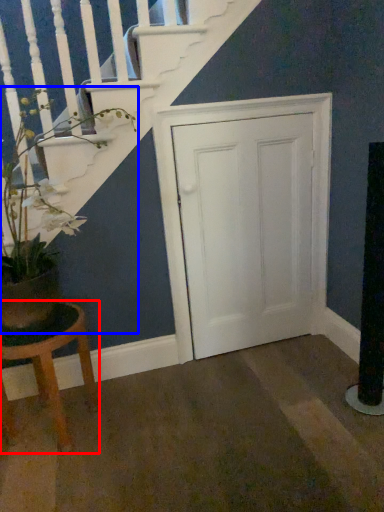
Question: Which of the following is the closest to the observer, stool (highlighted by a red box) or houseplant (highlighted by a blue box)?

Choices:
 (A) stool
 (B) houseplant

Answer: (B)